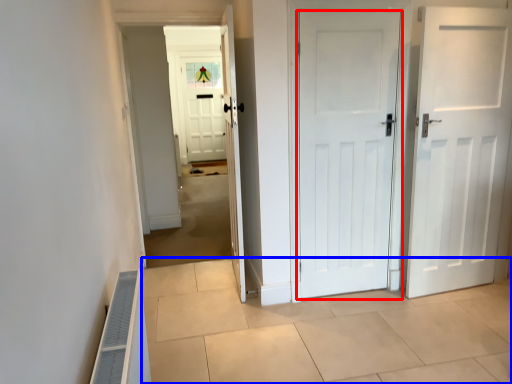
Question: Which of the following is the farthest to the observer, door (highlighted by a red box) or path (highlighted by a blue box)?

Choices:
 (A) door
 (B) path

Answer: (A)